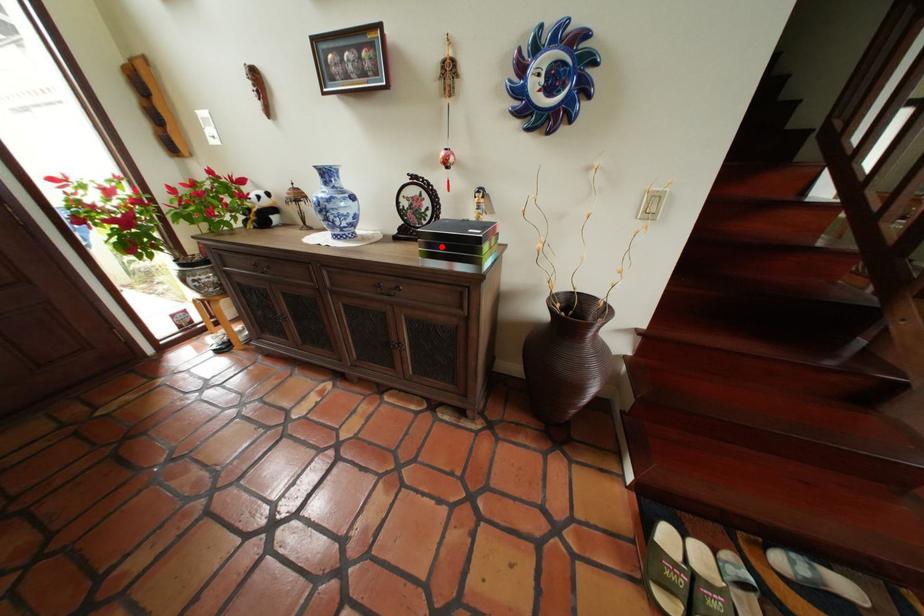
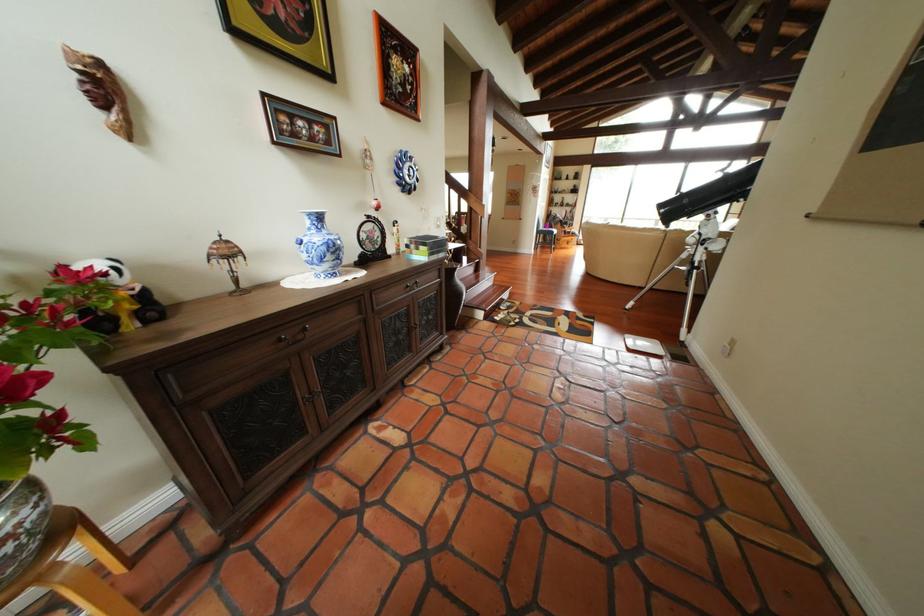
Question: A red point is marked in image1. In image2, is the corresponding 3D point closer to the camera or farther? Reply with the corresponding letter.

Choices:
 (A) The corresponding 3D point is closer.
 (B) The corresponding 3D point is farther.

Answer: (A)